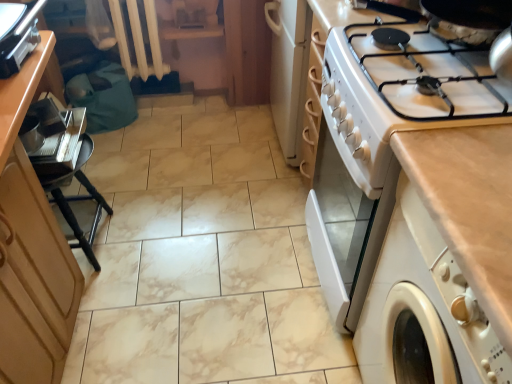
The image size is (512, 384). I want to click on wooden cabinet at left, so click(x=31, y=248).

In order to face wooden radiator at upper left, should I rotate leftwards or rightwards?

Rotate your view left by about 14.791°.

Locate an element on the screen. The image size is (512, 384). white glossy gas stove at upper right is located at coordinates (399, 95).

Is metallic silver toaster at upper left positioned with its back to wooden cabinet at left?

No, metallic silver toaster at upper left is not facing away from wooden cabinet at left.

From the picture: Does metallic silver toaster at upper left have a greater height compared to wooden cabinet at left?

No, metallic silver toaster at upper left is not taller than wooden cabinet at left.

Identify the location of cabinetry in front of the metallic silver toaster at upper left. (31, 248).

From a real-world perspective, who is located higher, metallic silver toaster at upper left or wooden cabinet at left?

metallic silver toaster at upper left, from a real-world perspective.

Is white glossy gas stove at upper right not near wooden radiator at upper left?

Yes, white glossy gas stove at upper right is far from wooden radiator at upper left.

Between white glossy gas stove at upper right and wooden radiator at upper left, which one has more height?

With more height is wooden radiator at upper left.

In the scene shown: How many degrees apart are the facing directions of white glossy gas stove at upper right and wooden radiator at upper left?

92.1 degrees.

Would you say white glossy gas stove at upper right is inside or outside wooden radiator at upper left?

white glossy gas stove at upper right exists outside the volume of wooden radiator at upper left.

Can you see metallic silver tray at left touching white glossy gas stove at upper right?

No, metallic silver tray at left is not beside white glossy gas stove at upper right.

From the picture: Does metallic silver tray at left have a lesser width compared to white glossy gas stove at upper right?

Indeed, metallic silver tray at left has a lesser width compared to white glossy gas stove at upper right.

Is metallic silver tray at left facing towards white glossy gas stove at upper right?

Yes, metallic silver tray at left is turned towards white glossy gas stove at upper right.

Is white glossy gas stove at upper right a part of metallic silver tray at left?

No.

Would you say beige laminate countertop at right is a long distance from wooden cabinet at left?

Yes, beige laminate countertop at right and wooden cabinet at left are quite far apart.

In the scene shown: Considering their positions, is beige laminate countertop at right located in front of or behind wooden cabinet at left?

→ Clearly, beige laminate countertop at right is in front of wooden cabinet at left.

Which is closer, (x=475, y=130) or (x=2, y=198)?

The point (x=475, y=130) is in front.

Is beige laminate countertop at right at the right side of wooden cabinet at left?

Indeed, beige laminate countertop at right is positioned on the right side of wooden cabinet at left.

Which object is closer to the camera, white glossy gas stove at upper right or beige laminate countertop at right?

beige laminate countertop at right is in front.

Considering the positions of points (394, 114) and (435, 148), is point (394, 114) farther from camera compared to point (435, 148)?

Yes, point (394, 114) is farther from viewer.

Find the location of a particular element. gas stove above the beige laminate countertop at right (from the image's perspective) is located at coordinates (399, 95).

Considering the relative sizes of white glossy gas stove at upper right and beige laminate countertop at right in the image provided, is white glossy gas stove at upper right smaller than beige laminate countertop at right?

Indeed, white glossy gas stove at upper right has a smaller size compared to beige laminate countertop at right.

Can you confirm if metallic silver tray at left is bigger than wooden cabinet at left?

Actually, metallic silver tray at left might be smaller than wooden cabinet at left.

Locate an element on the screen. The width and height of the screenshot is (512, 384). cabinetry below the metallic silver tray at left (from a real-world perspective) is located at coordinates [31, 248].

Does point (16, 119) lie in front of point (33, 64)?

Yes, point (16, 119) is in front of point (33, 64).

Consider the image. Does metallic silver toaster at upper left appear on the right side of white glossy gas stove at upper right?

Incorrect, metallic silver toaster at upper left is not on the right side of white glossy gas stove at upper right.

What's the angular difference between metallic silver toaster at upper left and white glossy gas stove at upper right's facing directions?

178 degrees separate the facing orientations of metallic silver toaster at upper left and white glossy gas stove at upper right.

Considering the positions of points (36, 1) and (403, 26), is point (36, 1) farther from camera compared to point (403, 26)?

Yes, it is behind point (403, 26).

You are a GUI agent. You are given a task and a screenshot of the screen. Output one action in this format:
    pyautogui.click(x=<x>, y=<y>)
    Task: Click on the cabinetry to the left of metallic silver toaster at upper left
    The image size is (512, 384).
    Given the screenshot: What is the action you would take?
    pyautogui.click(x=31, y=248)

This screenshot has height=384, width=512. Find the location of `gas stove located below the wooden radiator at upper left (from the image's perspective)`. gas stove located below the wooden radiator at upper left (from the image's perspective) is located at coordinates (399, 95).

Based on their spatial positions, is metallic silver tray at left or wooden radiator at upper left closer to white glossy gas stove at upper right?

Based on the image, metallic silver tray at left appears to be nearer to white glossy gas stove at upper right.

From the image, which object appears to be farther from metallic silver toaster at upper left, wooden cabinet at left or beige laminate countertop at right?

The object further to metallic silver toaster at upper left is beige laminate countertop at right.

Estimate the real-world distances between objects in this image. Which object is further from wooden radiator at upper left, wooden cabinet at left or metallic silver toaster at upper left?

wooden cabinet at left.

Looking at the image, which one is located further to wooden cabinet at left, metallic silver toaster at upper left or metallic silver tray at left?

metallic silver toaster at upper left is positioned further to the anchor wooden cabinet at left.

Which object lies nearer to the anchor point metallic silver tray at left, metallic silver toaster at upper left or beige laminate countertop at right?

metallic silver toaster at upper left is positioned closer to the anchor metallic silver tray at left.

Which object lies nearer to the anchor point beige laminate countertop at right, wooden cabinet at left or white glossy gas stove at upper right?

white glossy gas stove at upper right is positioned closer to the anchor beige laminate countertop at right.

From the image, which object appears to be nearer to wooden radiator at upper left, white glossy gas stove at upper right or wooden cabinet at left?

The object closer to wooden radiator at upper left is wooden cabinet at left.

Looking at the image, which one is located closer to metallic silver toaster at upper left, wooden radiator at upper left or wooden cabinet at left?

Based on the image, wooden cabinet at left appears to be nearer to metallic silver toaster at upper left.

This screenshot has height=384, width=512. Find the location of `gas stove between metallic silver toaster at upper left and beige laminate countertop at right in the horizontal direction`. gas stove between metallic silver toaster at upper left and beige laminate countertop at right in the horizontal direction is located at coordinates (399, 95).

Where is `counter between wooden cabinet at left and beige laminate countertop at right`? counter between wooden cabinet at left and beige laminate countertop at right is located at coordinates (21, 93).

The image size is (512, 384). What are the coordinates of `home appliance positioned between wooden cabinet at left and metallic silver tray at left from near to far` in the screenshot? It's located at (20, 40).

This screenshot has width=512, height=384. Find the location of `radiator between metallic silver tray at left and white glossy gas stove at upper right`. radiator between metallic silver tray at left and white glossy gas stove at upper right is located at coordinates (138, 40).